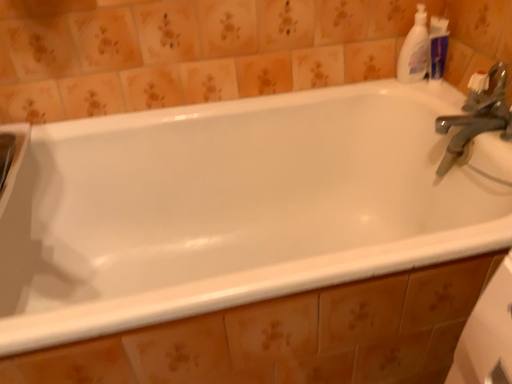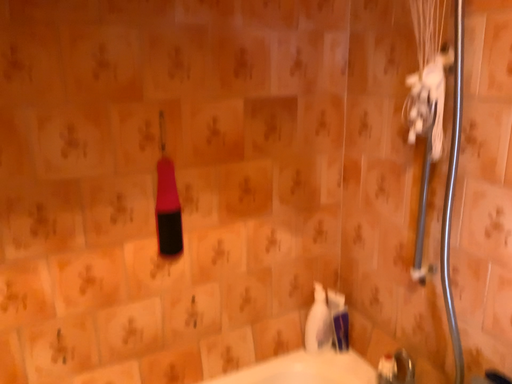
Question: Which way did the camera rotate in the video?

Choices:
 (A) rotated left
 (B) rotated right

Answer: (B)